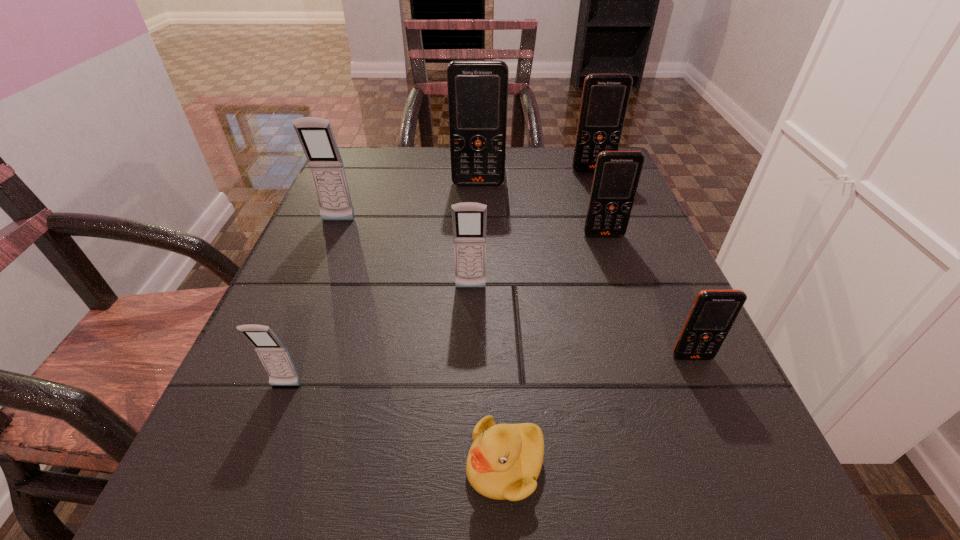
Where is `vacant area that lies between the third smallest orange cellular telephone and the nearest orange cellular telephone`? The image size is (960, 540). vacant area that lies between the third smallest orange cellular telephone and the nearest orange cellular telephone is located at coordinates (642, 264).

I want to click on free spot between the smallest orange cellular telephone and the fourth nearest cellular telephone, so click(648, 296).

Identify the location of object that is the seventh closest to the second nearest orange cellular telephone. (x=273, y=354).

Locate an element on the screen. The image size is (960, 540). object that stands as the fourth closest to the shortest object is located at coordinates (617, 173).

Identify which cellular telephone is the closest to the second farthest cellular telephone. Please provide its 2D coordinates. Your answer should be formatted as a tuple, i.e. [(x, y)], where the tuple contains the x and y coordinates of a point satisfying the conditions above.

[(605, 97)]

At what (x,y) coordinates should I click in order to perform the action: click on cellular telephone identified as the closest to the smallest orange cellular telephone. Please return your answer as a coordinate pair (x, y). This screenshot has height=540, width=960. Looking at the image, I should click on (617, 173).

You are a GUI agent. You are given a task and a screenshot of the screen. Output one action in this format:
    pyautogui.click(x=<x>, y=<y>)
    Task: Click on the orange cellular telephone identified as the closest to the third nearest cellular telephone
    Image resolution: width=960 pixels, height=540 pixels.
    Given the screenshot: What is the action you would take?
    pyautogui.click(x=617, y=173)

Locate which orange cellular telephone is the fourth closest to the farthest gray cellular telephone. Please provide its 2D coordinates. Your answer should be formatted as a tuple, i.e. [(x, y)], where the tuple contains the x and y coordinates of a point satisfying the conditions above.

[(713, 312)]

Locate which gray cellular telephone ranks third in proximity to the farthest orange cellular telephone. Please provide its 2D coordinates. Your answer should be formatted as a tuple, i.e. [(x, y)], where the tuple contains the x and y coordinates of a point satisfying the conditions above.

[(273, 354)]

Locate an element on the screen. This screenshot has width=960, height=540. gray cellular telephone that is the nearest to the second nearest gray cellular telephone is located at coordinates (273, 354).